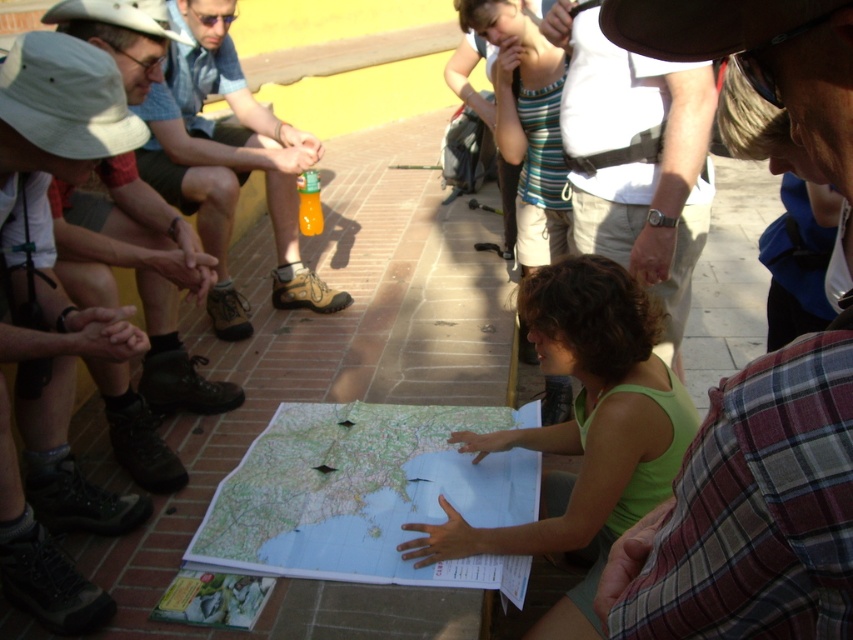
Question: Among these points, which one is nearest to the camera?

Choices:
 (A) (642, 211)
 (B) (590, 403)
 (C) (459, 509)

Answer: (B)

Question: Can you confirm if green fabric shirt at center is positioned below orange plastic bottle at left?

Choices:
 (A) no
 (B) yes

Answer: (B)

Question: Does white paper map at center appear over white cotton shirt at upper center?

Choices:
 (A) yes
 (B) no

Answer: (B)

Question: Does green fabric shirt at center appear under orange plastic bottle at left?

Choices:
 (A) yes
 (B) no

Answer: (A)

Question: Estimate the real-world distances between objects in this image. Which object is closer to the green fabric shirt at center?

Choices:
 (A) white cotton shirt at upper center
 (B) orange plastic bottle at left
 (C) white paper map at center

Answer: (C)

Question: Which point is closer to the camera?

Choices:
 (A) green fabric shirt at center
 (B) white paper map at center

Answer: (A)